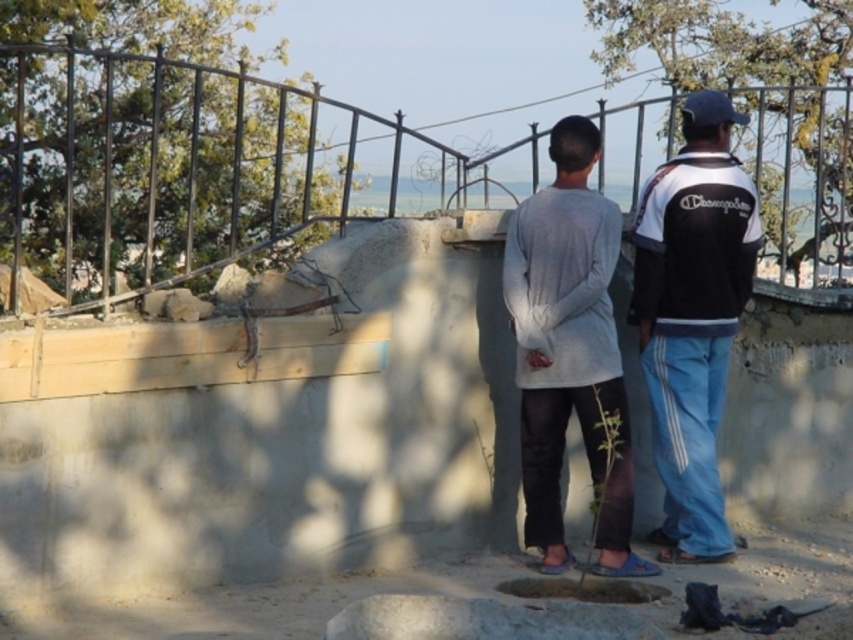
Between metallic wire fence at upper center and black and white track suit at right, which one has more height?

Standing taller between the two is black and white track suit at right.

In order to click on metallic wire fence at upper center in this screenshot , I will do `click(170, 168)`.

Where is `metallic wire fence at upper center`? metallic wire fence at upper center is located at coordinates (170, 168).

Between metallic wire fence at upper center and gray matte shirt at center, which one is positioned higher?

metallic wire fence at upper center is higher up.

Is metallic wire fence at upper center bigger than gray matte shirt at center?

Incorrect, metallic wire fence at upper center is not larger than gray matte shirt at center.

Which is in front, point (152, 157) or point (524, 301)?

Point (152, 157) is more forward.

This screenshot has height=640, width=853. I want to click on metallic wire fence at upper center, so click(170, 168).

Does black and white track suit at right have a smaller size compared to gray matte shirt at center?

No, black and white track suit at right is not smaller than gray matte shirt at center.

Find the location of a particular element. This screenshot has width=853, height=640. black and white track suit at right is located at coordinates (692, 317).

Where is `black and white track suit at right`? Image resolution: width=853 pixels, height=640 pixels. black and white track suit at right is located at coordinates (692, 317).